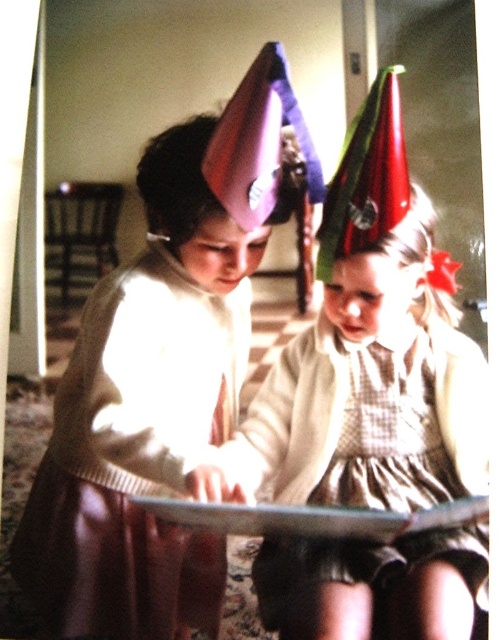
You are a character in the image and you want to move from point [66,611] to point [425,552]. Which direction should you move?

Since point [66,611] is behind point [425,552], you should move forward to reach point [425,552].

You are a parent trying to dress your child. You have a matte white sweater at center and a checkered fabric dress at center. Which clothing item is currently covering the other?

The matte white sweater at center is positioned over the checkered fabric dress at center, so the sweater is covering the dress.

You are a tailor measuring the width of two garments for a costume fitting. You have the matte white sweater at center and the checkered fabric dress at center. Which garment has a greater width?

Result: The matte white sweater at center has a greater width than the checkered fabric dress at center according to the description.